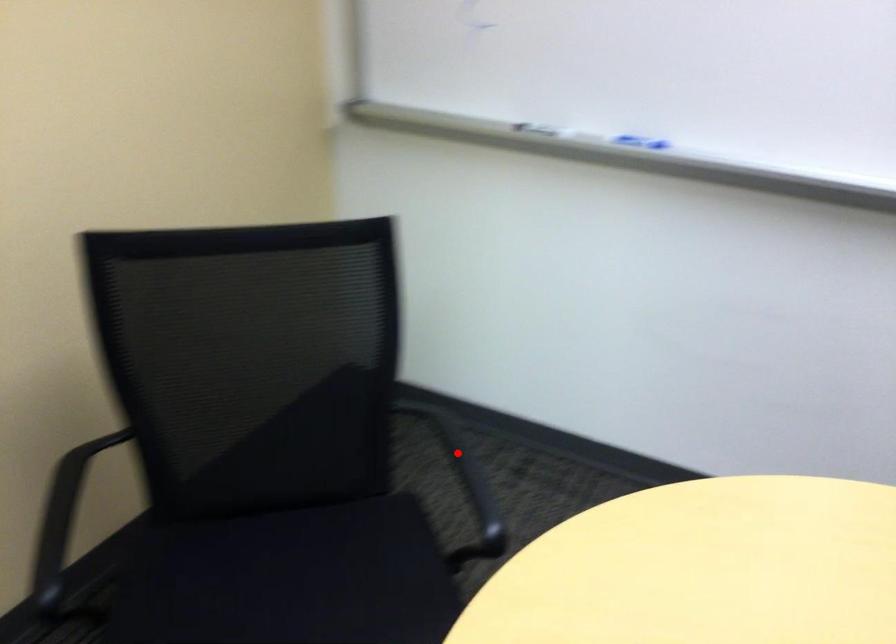
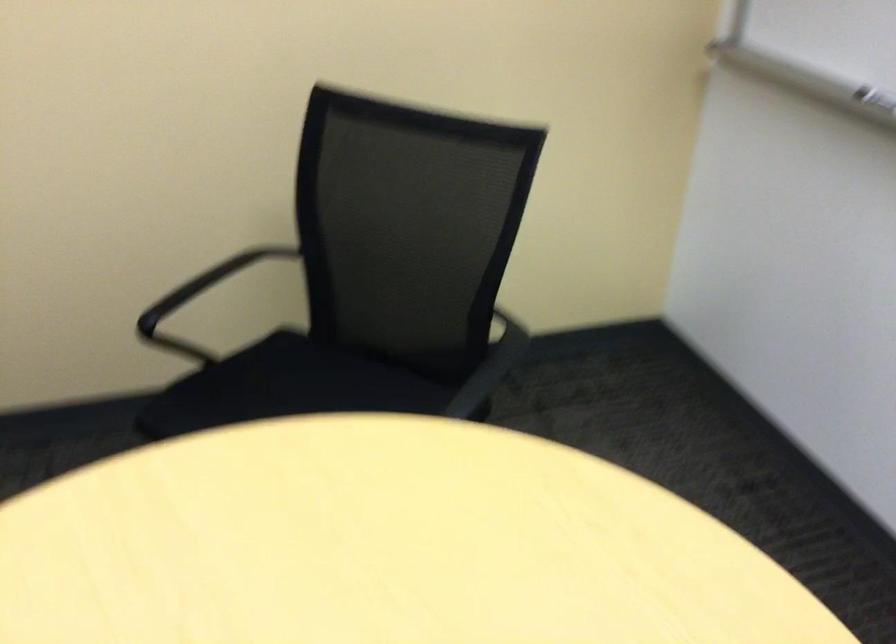
In the second image, find the point that corresponds to the highlighted location in the first image.

(489, 368)